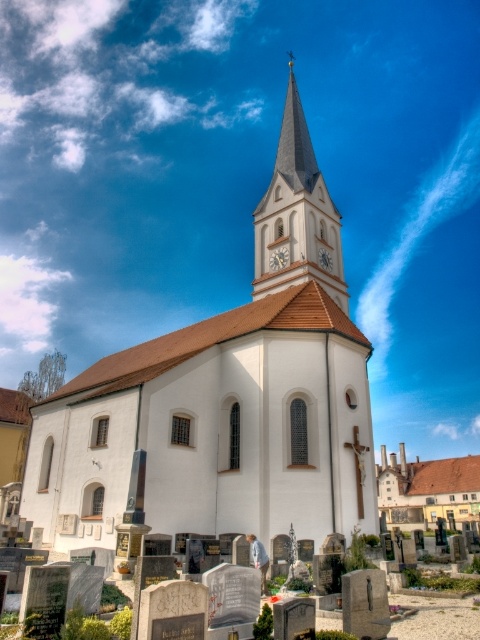
You are standing at the entrance of the church and want to locate the smooth gray steeple at center. Based on the coordinates provided, in which direction should you look to see it?

The smooth gray steeple at center is located at coordinates point (297,212), which means you should look to the upper left direction from your current position at the entrance to see it.

You are standing in front of the scene described. There is a point marked at coordinates (x=225, y=400). According to the scene description, what object is located at that point?

The point at coordinates (x=225, y=400) indicates the white matte church at center.

You are standing in front of the church and want to take a photo that includes the smooth gray steeple at center. If your camera can only focus on objects within 200 feet, will the steeple be in focus?

The smooth gray steeple at center is 197.57 feet from the camera, which is within the 200 feet focus range. Therefore, the steeple will be in focus.